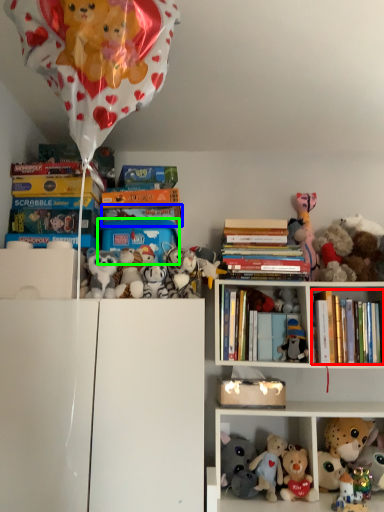
Question: Considering the real-world distances, which object is farthest from book (highlighted by a red box)? book (highlighted by a blue box) or box (highlighted by a green box)?

Choices:
 (A) book
 (B) box

Answer: (A)